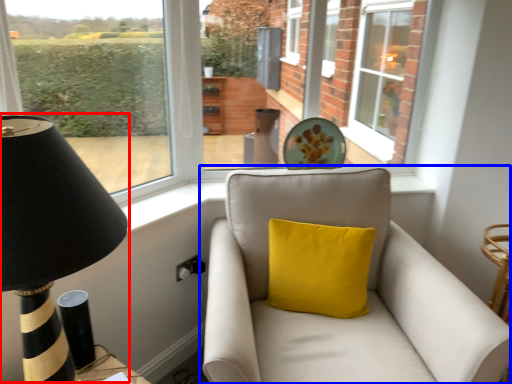
Question: Which point is further to the camera, table lamp (highlighted by a red box) or studio couch (highlighted by a blue box)?

Choices:
 (A) table lamp
 (B) studio couch

Answer: (B)